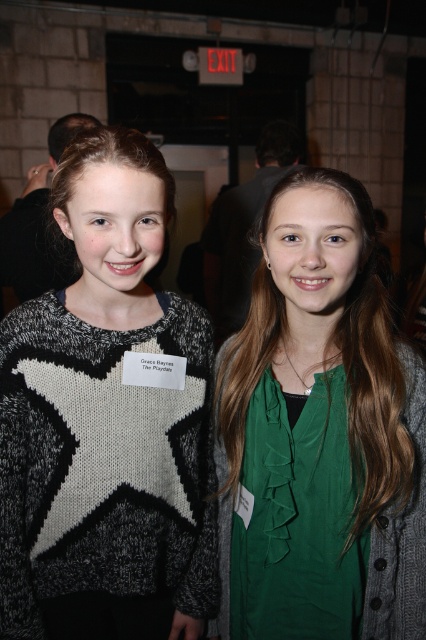
Question: Can you confirm if knit sweater with star at center is positioned to the left of green fabric shirt at center?

Choices:
 (A) yes
 (B) no

Answer: (A)

Question: Does knit sweater with star at center appear under green fabric shirt at center?

Choices:
 (A) no
 (B) yes

Answer: (A)

Question: Where is knit sweater with star at center located in relation to green fabric shirt at center in the image?

Choices:
 (A) left
 (B) right

Answer: (A)